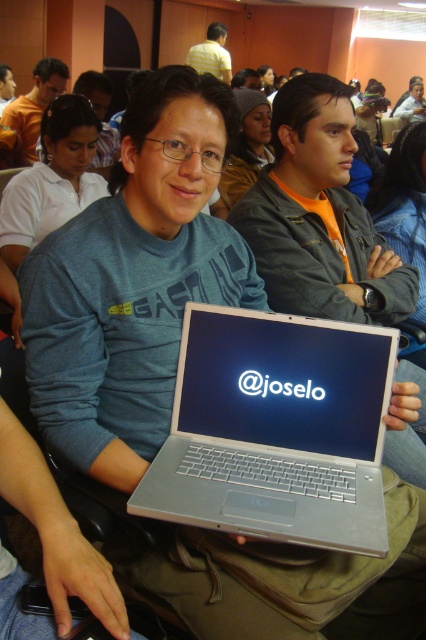
Question: From the image, what is the correct spatial relationship of matte gray jacket at center in relation to matte black laptop at center?

Choices:
 (A) below
 (B) above

Answer: (A)

Question: Which of these objects is positioned farthest from the matte gray jacket at center?

Choices:
 (A) matte black laptop at center
 (B) yellow shirt at upper center

Answer: (B)

Question: Which point is closer to the camera?

Choices:
 (A) (316, 205)
 (B) (5, 74)
 (C) (207, 61)

Answer: (A)

Question: Considering the relative positions of matte gray jacket at center and matte gray shirt at center in the image provided, where is matte gray jacket at center located with respect to matte gray shirt at center?

Choices:
 (A) below
 (B) above

Answer: (A)

Question: Which of these objects is positioned farthest from the yellow shirt at upper center?

Choices:
 (A) matte gray jacket at center
 (B) matte gray shirt at center

Answer: (A)

Question: In this image, where is matte gray jacket at center located relative to matte gray shirt at center?

Choices:
 (A) right
 (B) left

Answer: (A)